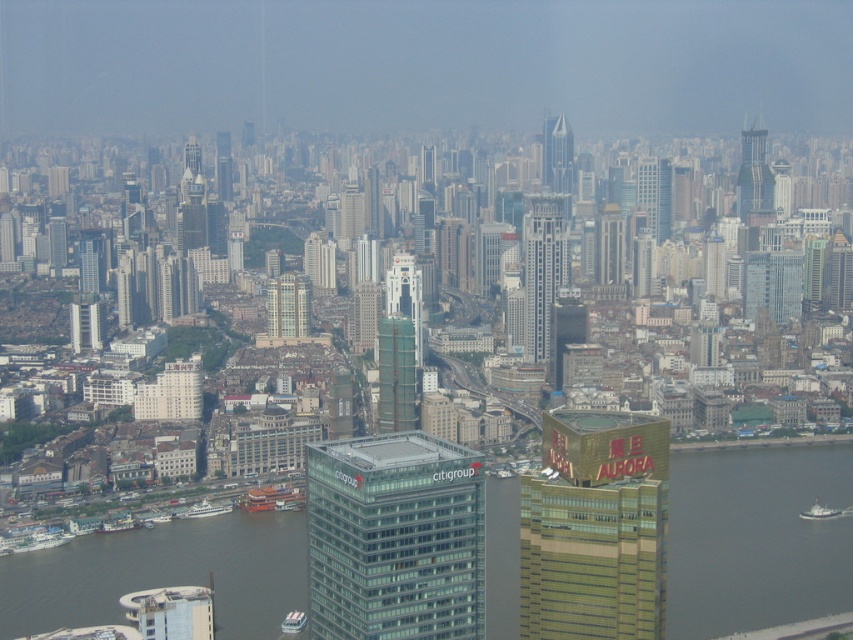
Does gold glass building at center-right have a larger size compared to glassy reflective skyscraper at upper right?

Correct, gold glass building at center-right is larger in size than glassy reflective skyscraper at upper right.

Between point (618, 513) and point (773, 193), which one is positioned behind?

The point (773, 193) is behind.

Between point (553, 564) and point (753, 128), which one is positioned in front?

Positioned in front is point (553, 564).

Find the location of `gold glass building at center-right`. gold glass building at center-right is located at coordinates (595, 528).

Does gold glass building at center-right have a smaller size compared to white glass building at center?

Actually, gold glass building at center-right might be larger than white glass building at center.

Find the location of `gold glass building at center-right`. gold glass building at center-right is located at coordinates 595,528.

Where is `gold glass building at center-right`? gold glass building at center-right is located at coordinates (595, 528).

Which of these two, gold reflective skyscraper at upper right or white plastic boat at lower center, stands shorter?

With less height is white plastic boat at lower center.

The height and width of the screenshot is (640, 853). Find the location of `gold reflective skyscraper at upper right`. gold reflective skyscraper at upper right is located at coordinates (654, 195).

This screenshot has width=853, height=640. I want to click on gold reflective skyscraper at upper right, so click(654, 195).